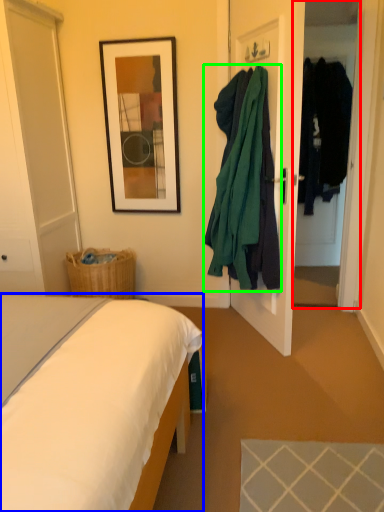
Question: Which object is positioned closest to glass door (highlighted by a red box)? Select from bed (highlighted by a blue box) and clothing (highlighted by a green box).

Choices:
 (A) bed
 (B) clothing

Answer: (B)